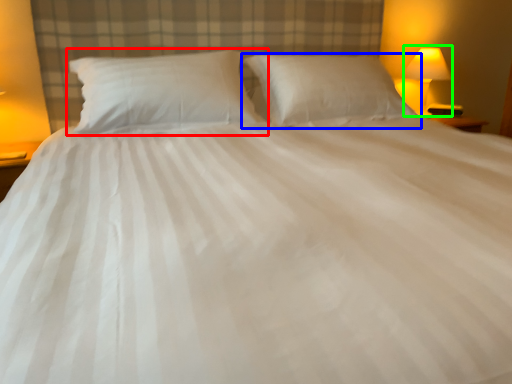
Question: Based on their relative distances, which object is nearer to pillow (highlighted by a red box)? Choose from pillow (highlighted by a blue box) and bedside lamp (highlighted by a green box).

Choices:
 (A) pillow
 (B) bedside lamp

Answer: (A)